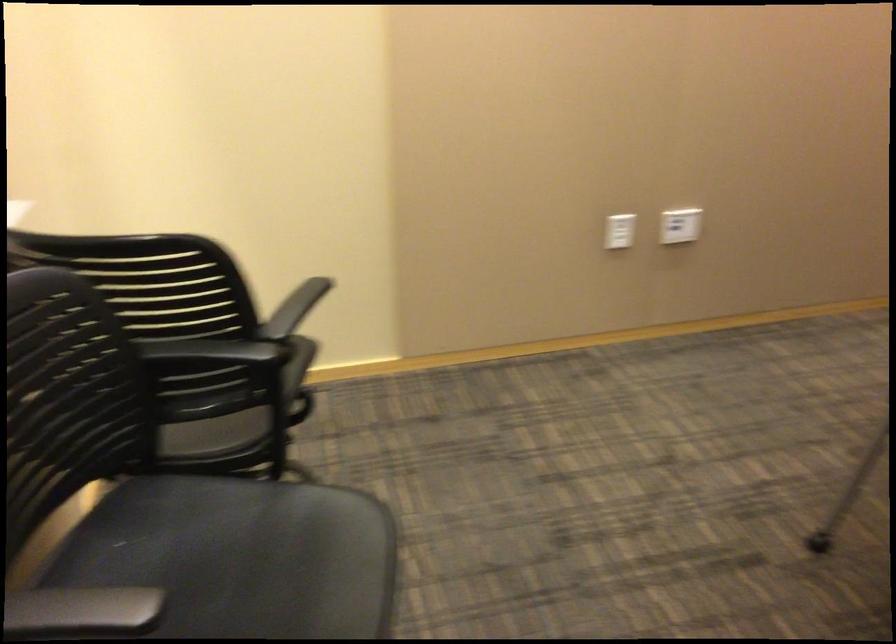
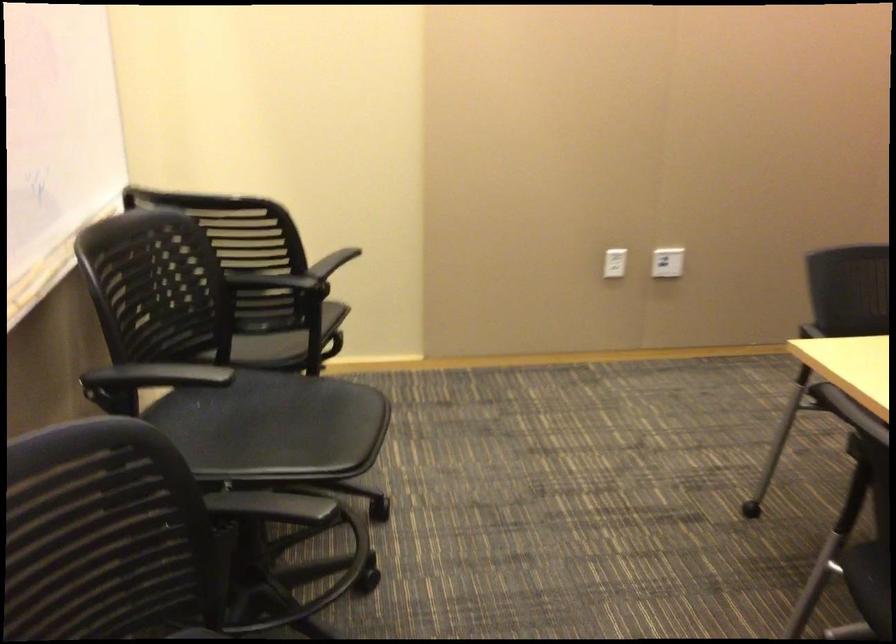
Find the pixel in the second image that matches the point at 675,225 in the first image.

(667, 261)